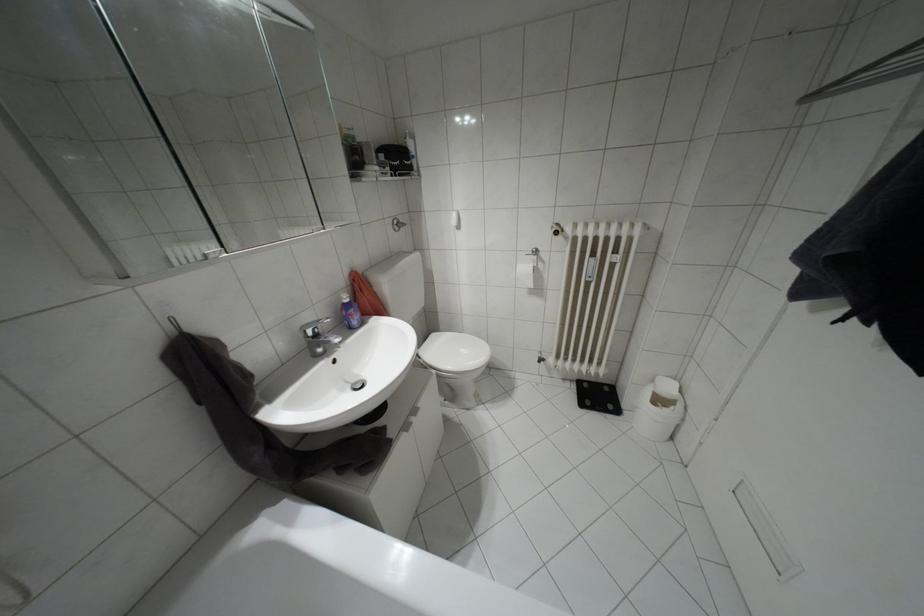
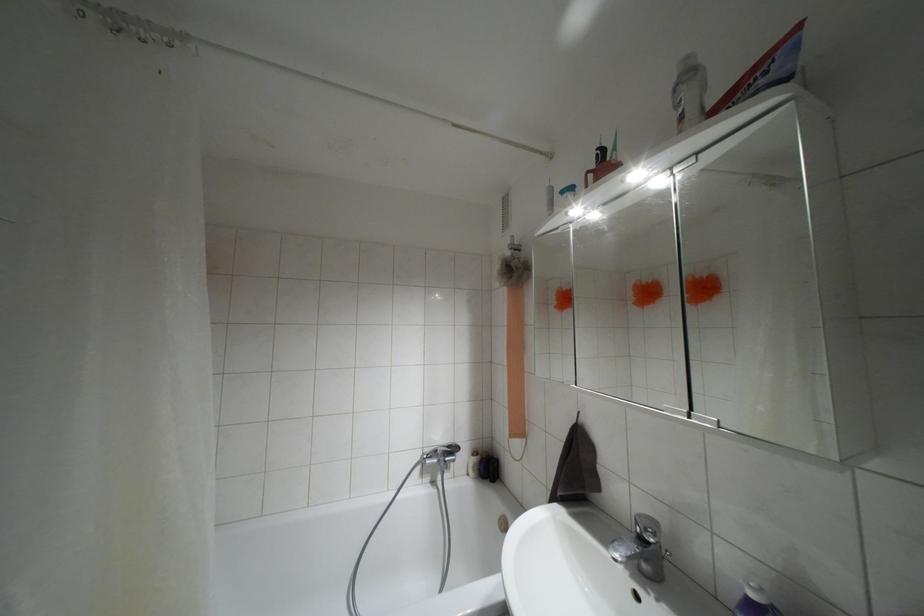
Where in the second image is the point corresponding to (315,334) from the first image?

(641, 538)